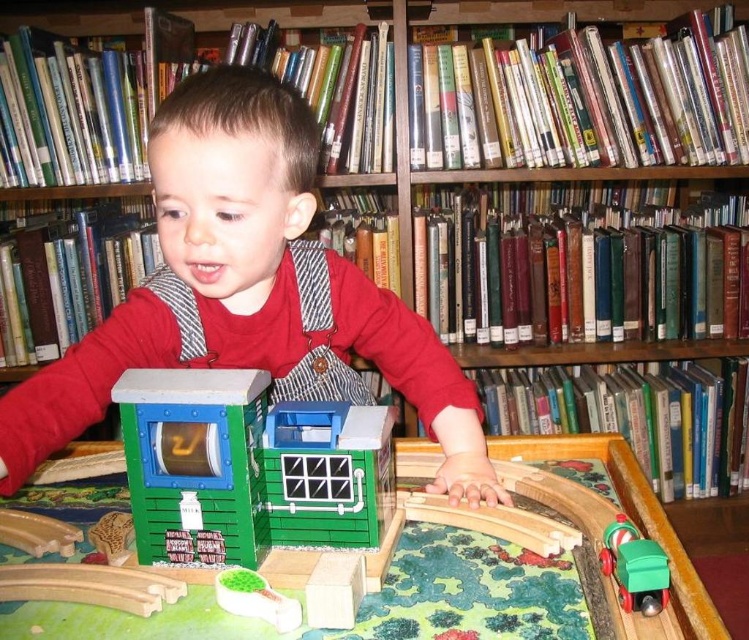
Question: Which object is closer to the camera taking this photo?

Choices:
 (A) green plastic train at lower right
 (B) green plastic building at center

Answer: (A)

Question: Does green plastic building at center appear on the right side of green plastic train at lower right?

Choices:
 (A) yes
 (B) no

Answer: (B)

Question: Does green plastic building at center appear over green plastic train at lower right?

Choices:
 (A) yes
 (B) no

Answer: (A)

Question: Considering the relative positions of green plastic building at center and green plastic train at lower right in the image provided, where is green plastic building at center located with respect to green plastic train at lower right?

Choices:
 (A) above
 (B) below

Answer: (A)

Question: Which of the following is the closest to the observer?

Choices:
 (A) green plastic building at center
 (B) green plastic train at lower right

Answer: (B)